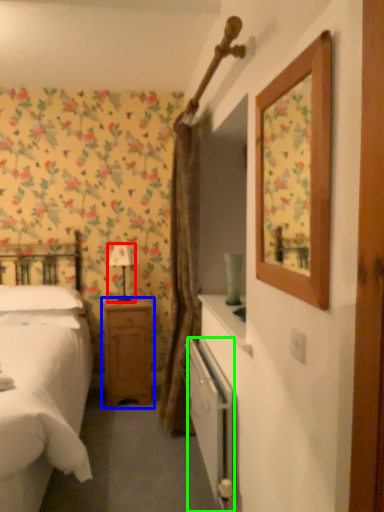
Question: Which object is positioned farthest from table lamp (highlighted by a red box)? Select from nightstand (highlighted by a blue box) and radiator (highlighted by a green box).

Choices:
 (A) nightstand
 (B) radiator

Answer: (B)